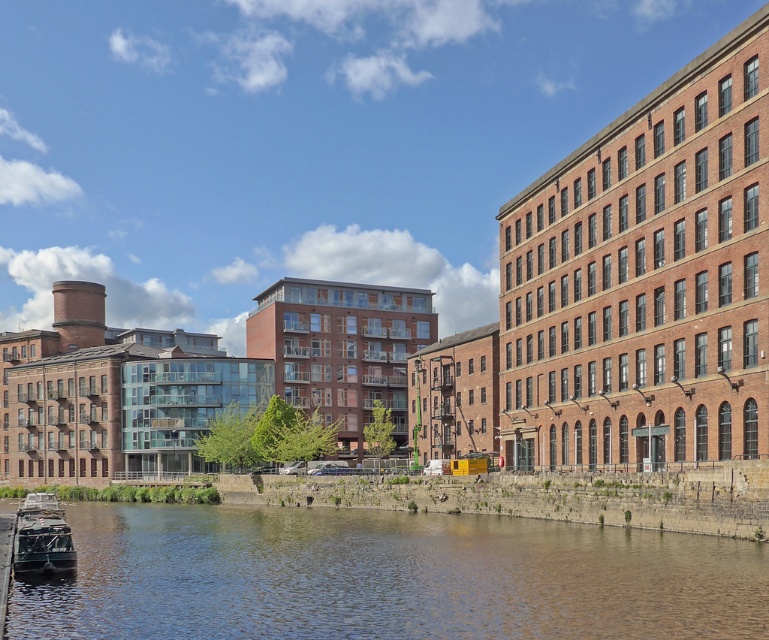
Question: Is brown stone river at lower left above metallic gray boat at lower left?

Choices:
 (A) no
 (B) yes

Answer: (A)

Question: Is brown stone river at lower left in front of metallic gray boat at lower left?

Choices:
 (A) no
 (B) yes

Answer: (B)

Question: Is brown stone river at lower left smaller than metallic gray boat at lower left?

Choices:
 (A) no
 (B) yes

Answer: (A)

Question: Which object is farther from the camera taking this photo?

Choices:
 (A) metallic gray boat at lower left
 (B) brown stone river at lower left

Answer: (A)

Question: Which point appears closest to the camera in this image?

Choices:
 (A) (245, 531)
 (B) (45, 560)

Answer: (B)